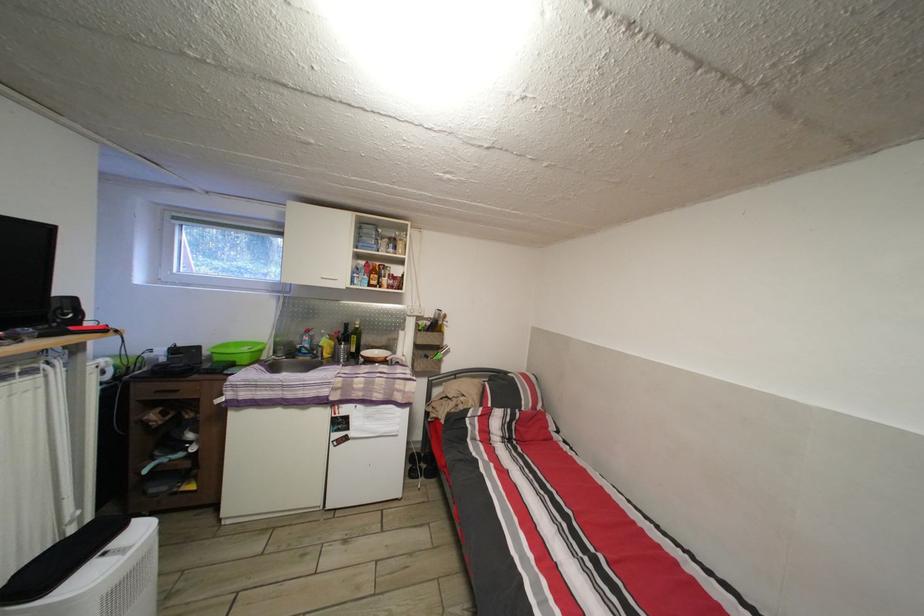
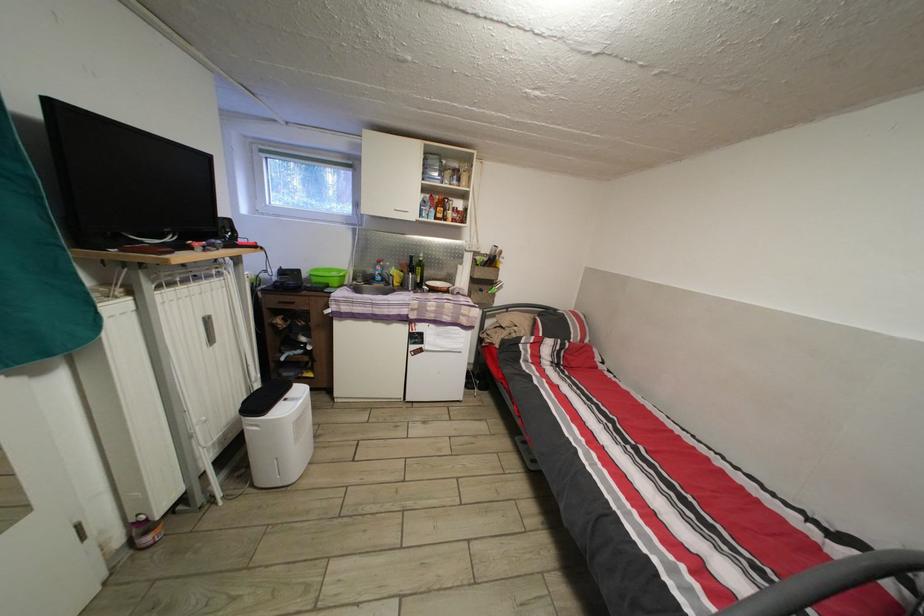
Locate, in the second image, the point that corresponds to point (213, 359) in the first image.

(311, 282)